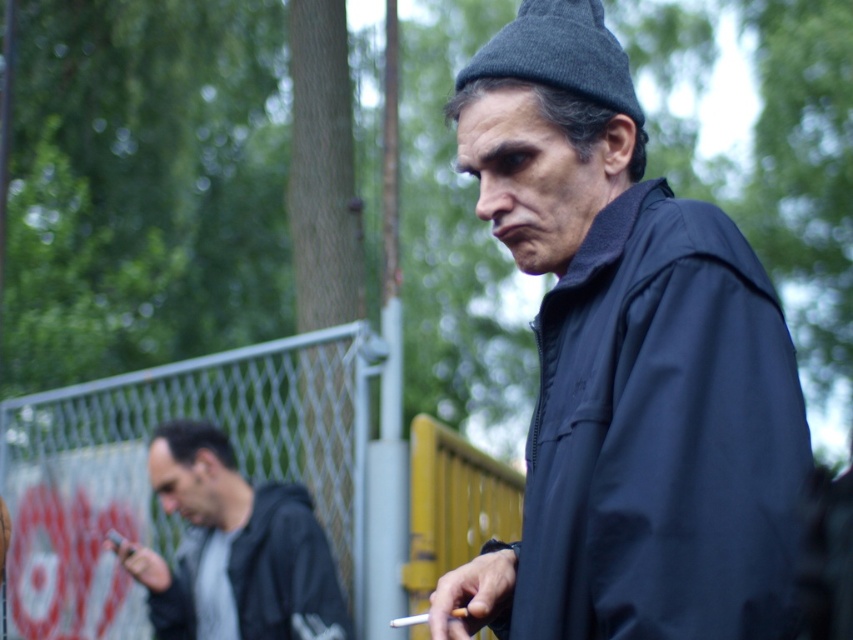
Which is more to the left, dark gray hoodie at left or white matte cigarette at center?

dark gray hoodie at left

Which is behind, point (310, 637) or point (457, 616)?

The point (310, 637) is more distant.

Where is `dark gray hoodie at left`? This screenshot has width=853, height=640. dark gray hoodie at left is located at coordinates (233, 548).

Does matte black jacket at center have a greater height compared to metallic chain-link fence at center-left?

No, matte black jacket at center is not taller than metallic chain-link fence at center-left.

This screenshot has width=853, height=640. I want to click on matte black jacket at center, so click(625, 368).

Between point (573, 77) and point (466, 616), which one is positioned behind?

Point (466, 616)

Is point (567, 284) closer to viewer compared to point (456, 614)?

Yes, it is in front of point (456, 614).

Who is more distant from viewer, (628,467) or (466,616)?

Point (466,616)

Find the location of a particular element. Image resolution: width=853 pixels, height=640 pixels. matte black jacket at center is located at coordinates (625, 368).